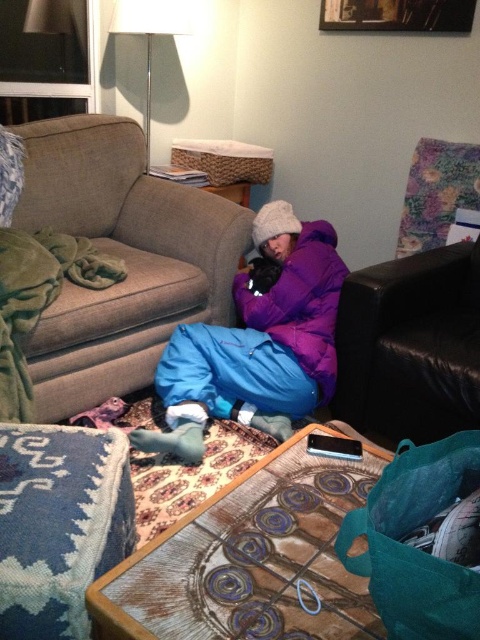
Measure the distance from purple down jacket at center to teal fabric sleeping bag at lower right.

A distance of 3.61 feet exists between purple down jacket at center and teal fabric sleeping bag at lower right.

Does point (291, 257) come closer to viewer compared to point (477, 444)?

No, it is behind (477, 444).

Locate an element on the screen. The height and width of the screenshot is (640, 480). purple down jacket at center is located at coordinates (256, 342).

Does beige fabric couch at center appear on the right side of black leather couch at right?

No, beige fabric couch at center is not to the right of black leather couch at right.

Does beige fabric couch at center appear on the left side of black leather couch at right?

Yes, beige fabric couch at center is to the left of black leather couch at right.

Identify the location of beige fabric couch at center. (120, 259).

Who is higher up, beige fabric couch at center or white fabric lampshade at upper center?

white fabric lampshade at upper center

Who is positioned more to the left, beige fabric couch at center or white fabric lampshade at upper center?

beige fabric couch at center is more to the left.

The height and width of the screenshot is (640, 480). What are the coordinates of `beige fabric couch at center` in the screenshot? It's located at (120, 259).